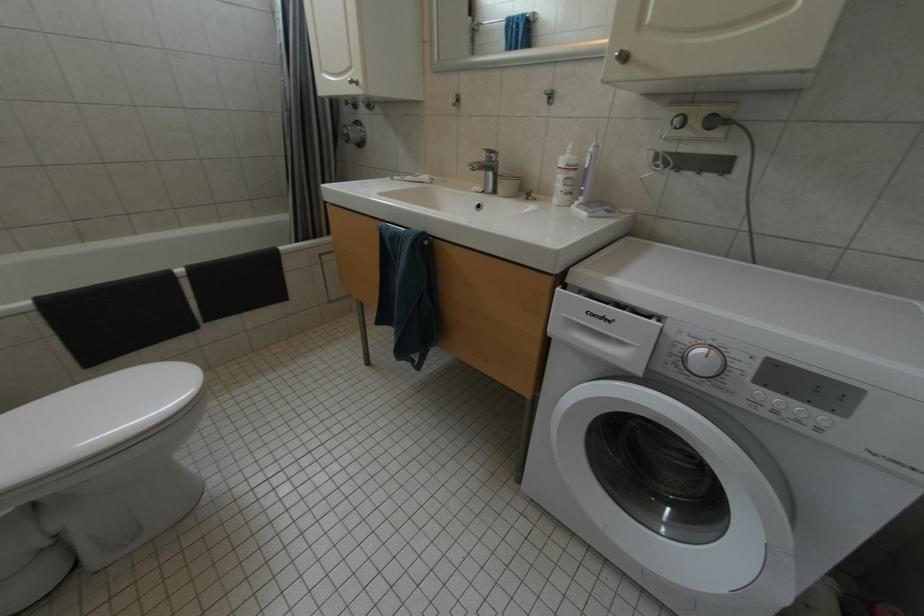
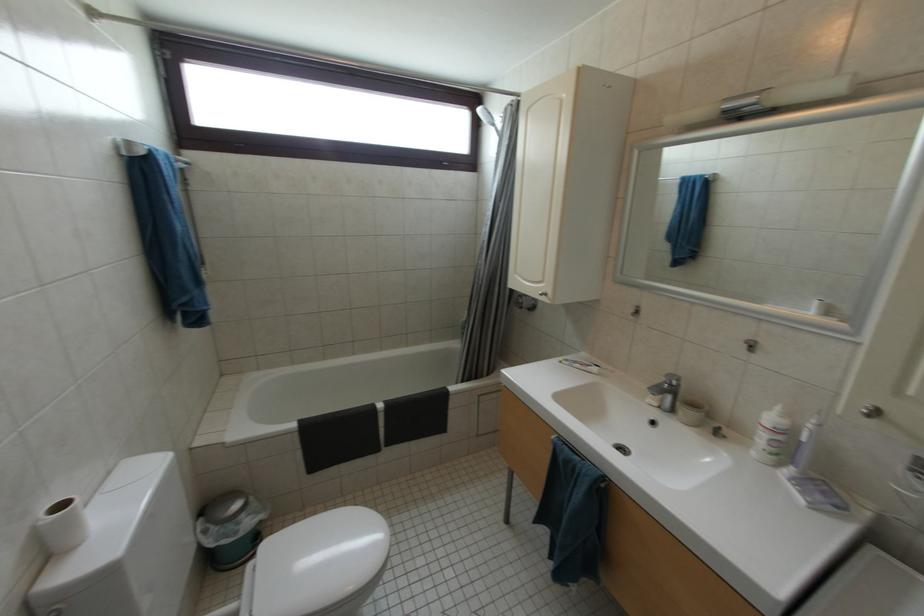
Question: The camera is either moving clockwise (left) or counter-clockwise (right) around the object. The first image is from the beginning of the video and the second image is from the end. Is the camera moving left or right when shooting the video?

Choices:
 (A) Left
 (B) Right

Answer: (B)